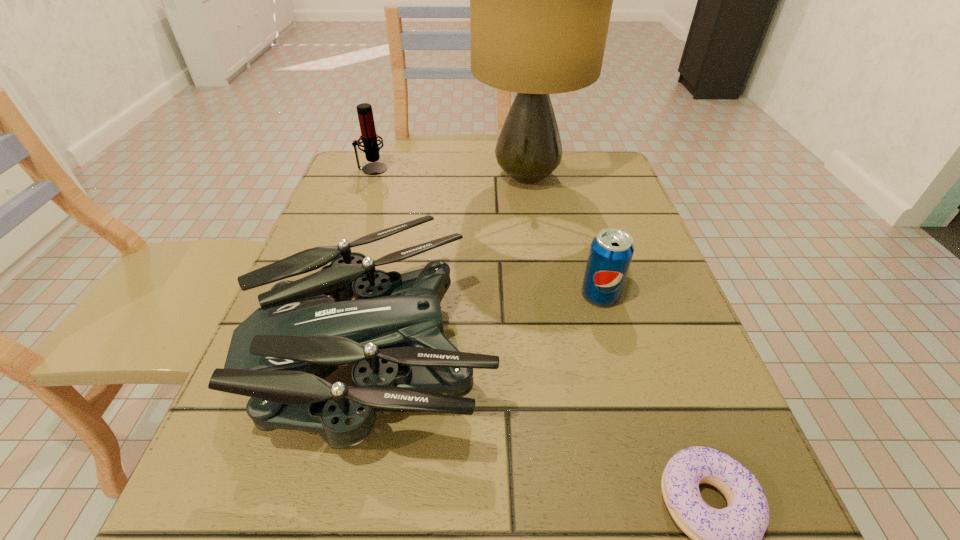
You are a GUI agent. You are given a task and a screenshot of the screen. Output one action in this format:
    pyautogui.click(x=<x>, y=<y>)
    Task: Click on the tallest object
    The width and height of the screenshot is (960, 540).
    Given the screenshot: What is the action you would take?
    pyautogui.click(x=540, y=0)

I want to click on the fourth shortest object, so click(x=369, y=137).

This screenshot has height=540, width=960. In order to click on drone in this screenshot , I will do (x=279, y=356).

Where is `pop soda`? pop soda is located at coordinates (611, 251).

Identify the location of blank space located on the front of the lampshade. The width and height of the screenshot is (960, 540). (540, 263).

Find the location of `vacant space located on the front of the microphone`. vacant space located on the front of the microphone is located at coordinates (350, 231).

The width and height of the screenshot is (960, 540). What are the coordinates of `free point located 0.310m on the back of the drone` in the screenshot? It's located at (412, 181).

The width and height of the screenshot is (960, 540). I want to click on vacant region located on the back of the pop soda, so coord(578,217).

This screenshot has height=540, width=960. In order to click on lampshade located at the far edge in this screenshot , I will do `click(540, 0)`.

The image size is (960, 540). Identify the location of microphone that is at the far edge. (369, 137).